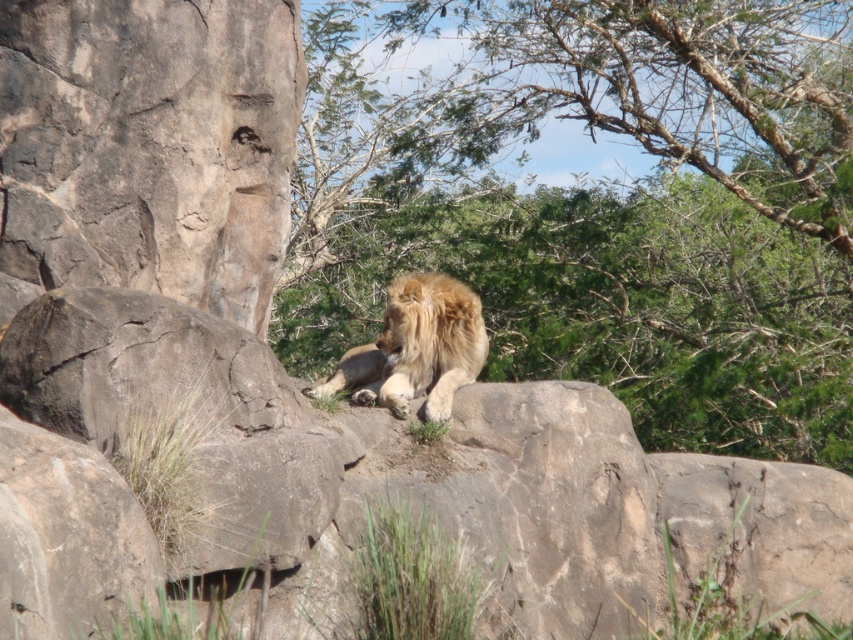
You are a zookeeper planning to feed the golden fur lion at center. You have a basket of apples placed under the green leafy tree at upper center. To reach the lion without disturbing it, should you place the apples on the ground below the tree or on the rocky outcrop near the lion?

The green leafy tree at upper center is positioned over the golden fur lion at center, so placing the apples on the ground below the tree would be directly above the lion. To avoid disturbing it, place the apples on the rocky outcrop near the lion instead.

You are a photographer aiming to capture the golden fur lion at center with the green leafy tree at upper center in the background. Based on their positions, can you determine if the tree is positioned to the right or left side of the lion?

The green leafy tree at upper center is to the right of the golden fur lion at center, so the tree is positioned to the right side of the lion.

You are a bird flying above the scene. You want to land on the highest point between the green leafy tree at upper center and the golden fur lion at center. Which one should you choose?

The green leafy tree at upper center has a greater height compared to the golden fur lion at center, so you should choose the green leafy tree at upper center to land on as it is the highest point.